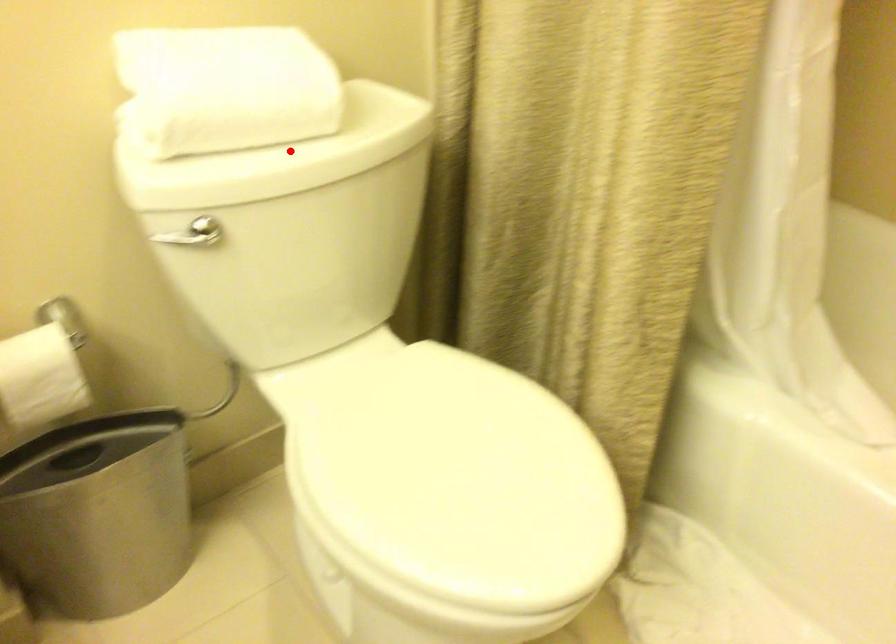
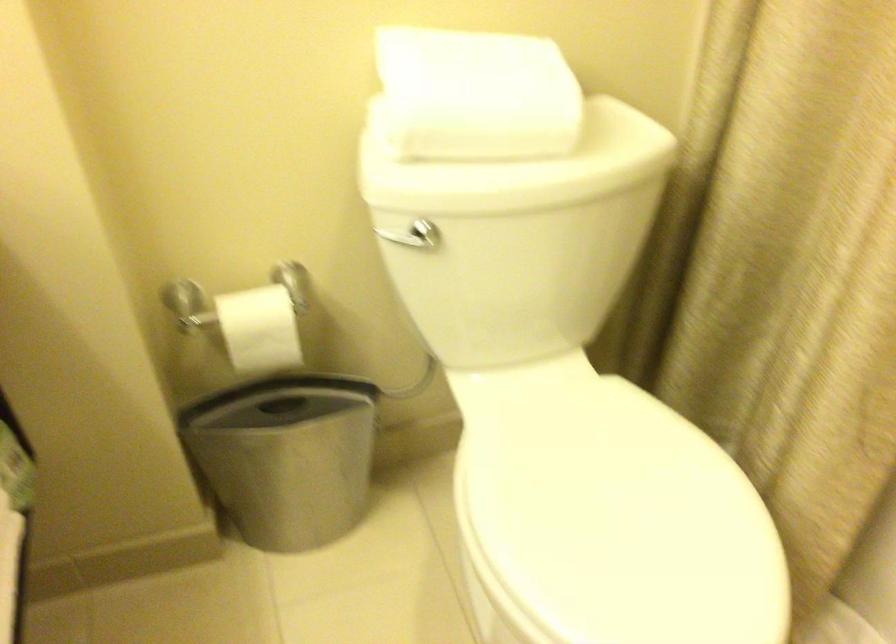
Find the pixel in the second image that matches the highlighted location in the first image.

(519, 167)